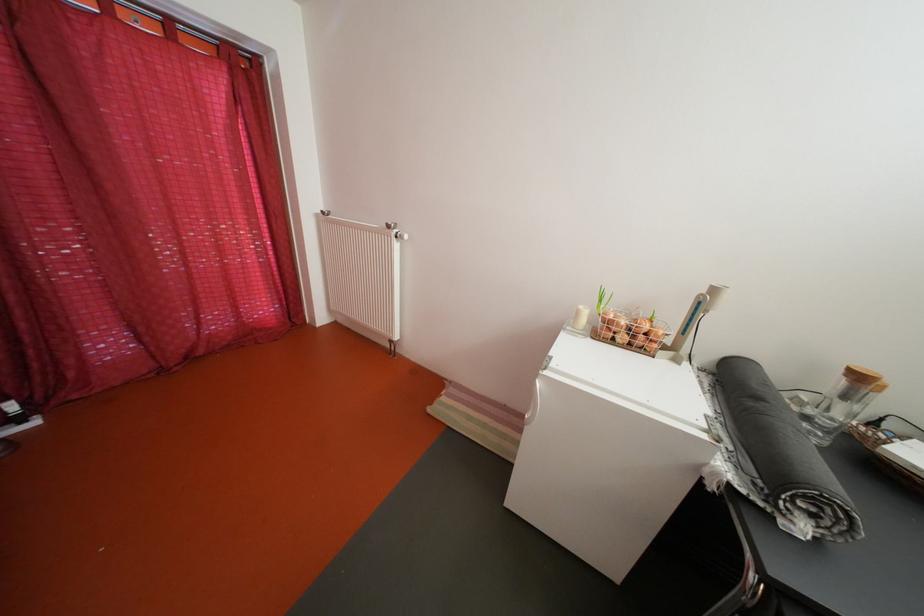
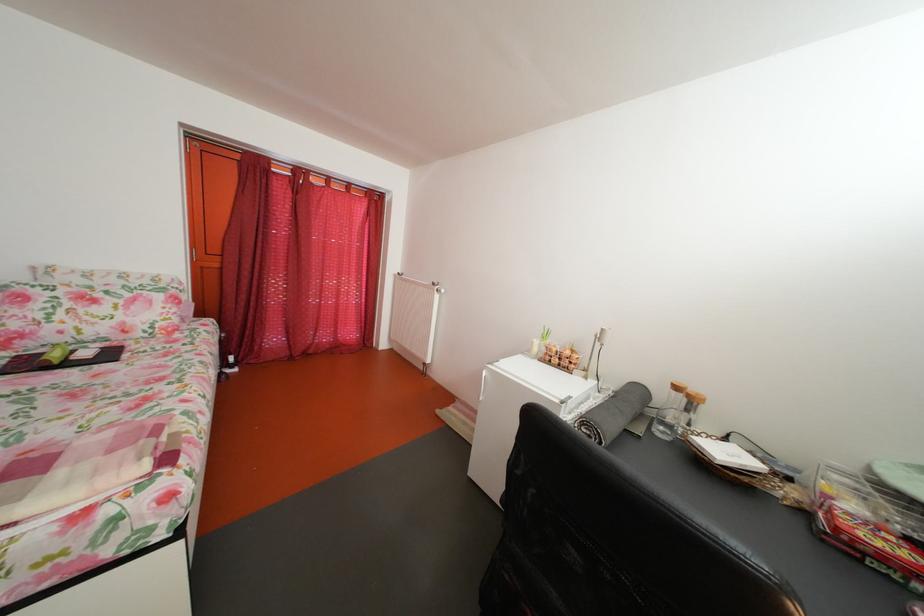
Which direction would the cameraman need to move to produce the second image?

The movement direction of the cameraman is right, backward.